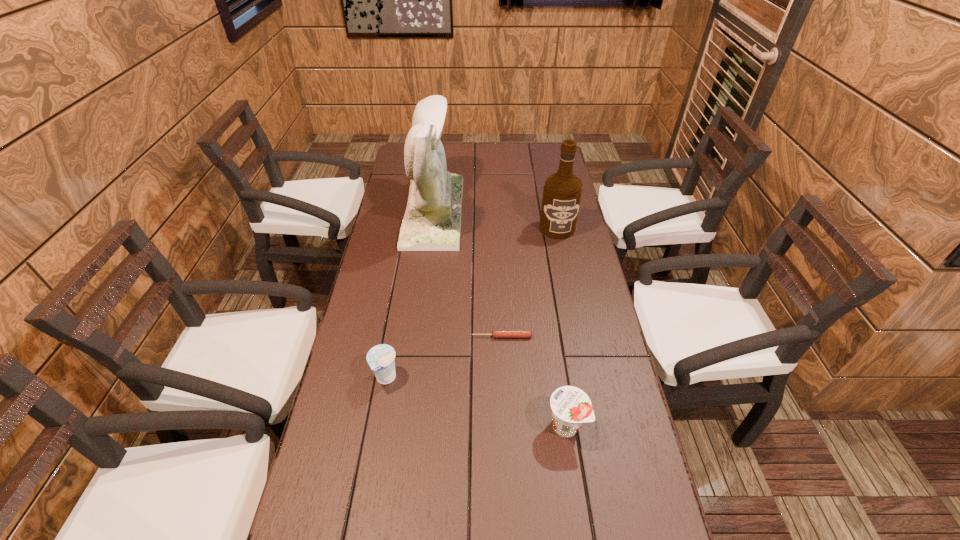
The height and width of the screenshot is (540, 960). I want to click on sculpture, so click(x=432, y=219).

This screenshot has height=540, width=960. Find the location of `the second tallest object`. the second tallest object is located at coordinates (562, 192).

You are a GUI agent. You are given a task and a screenshot of the screen. Output one action in this format:
    pyautogui.click(x=<x>, y=<y>)
    Task: Click on the nearest object
    This screenshot has height=540, width=960.
    Given the screenshot: What is the action you would take?
    pyautogui.click(x=571, y=406)

Locate an element on the screen. The height and width of the screenshot is (540, 960). the nearer yogurt is located at coordinates (571, 406).

Find the location of `the fourth farthest object`. the fourth farthest object is located at coordinates (380, 358).

Identify the location of the left yogurt. (380, 358).

You are a GUI agent. You are given a task and a screenshot of the screen. Output one action in this format:
    pyautogui.click(x=<x>, y=<y>)
    Task: Click on the shortest object
    
    Given the screenshot: What is the action you would take?
    [495, 334]

This screenshot has height=540, width=960. Find the location of `sausage`. sausage is located at coordinates (495, 334).

Where is `vacant space located on the base of the tallest object`? This screenshot has width=960, height=540. vacant space located on the base of the tallest object is located at coordinates (485, 211).

Locate an element on the screen. This screenshot has width=960, height=540. vacant space situated on the label of the alcohol is located at coordinates (568, 283).